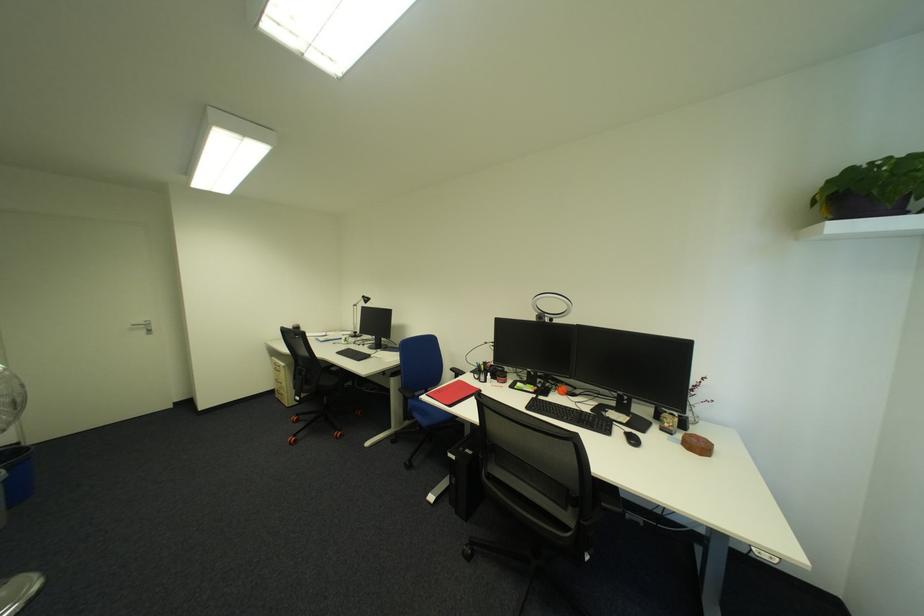
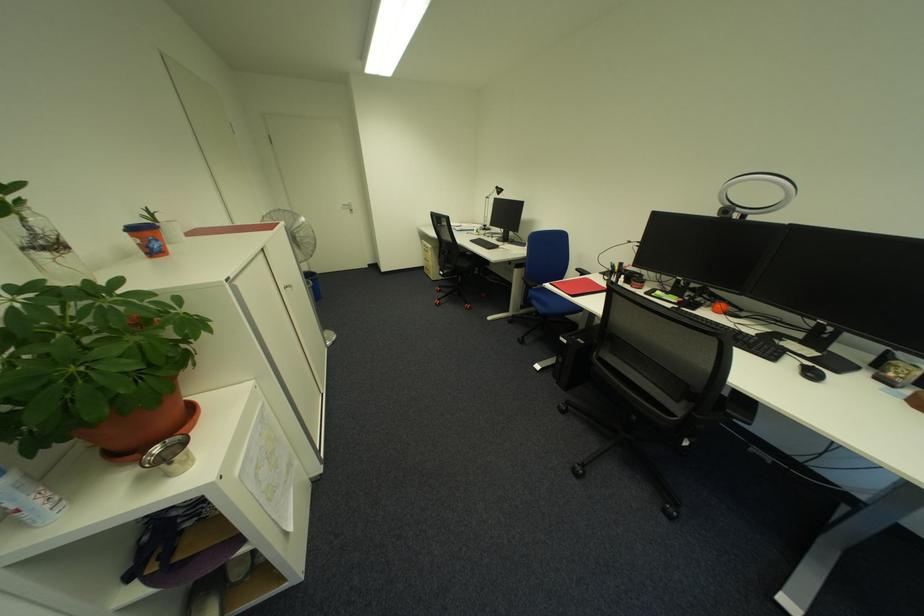
In the second image, find the point that corresponds to pixel 436 395 in the first image.

(560, 285)